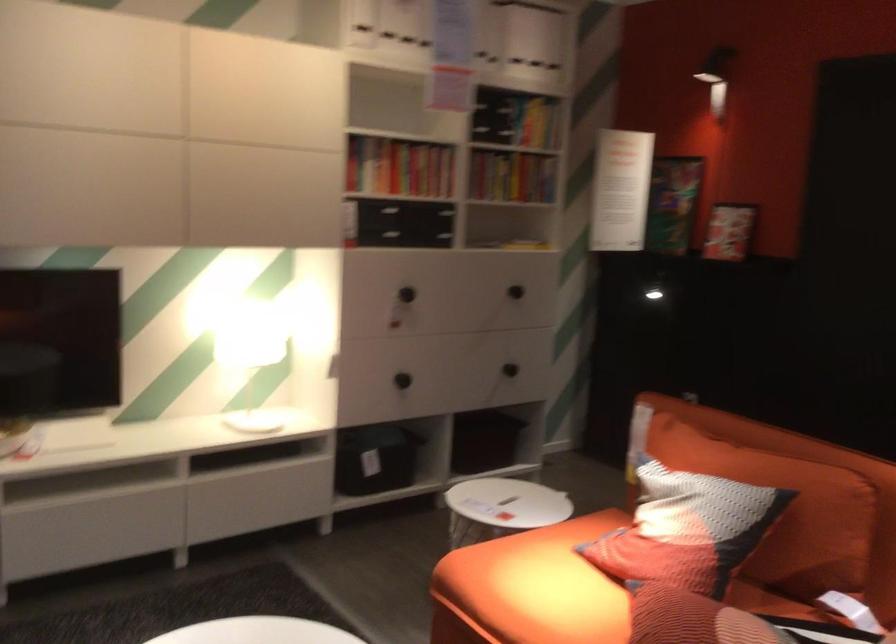
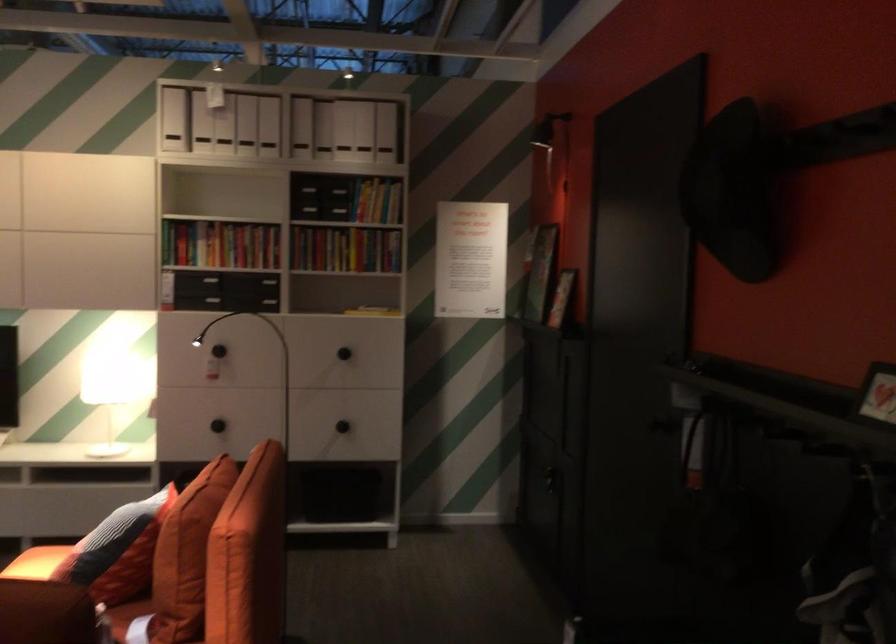
In the second image, find the point that corresponds to point 555,561 in the first image.

(36, 563)